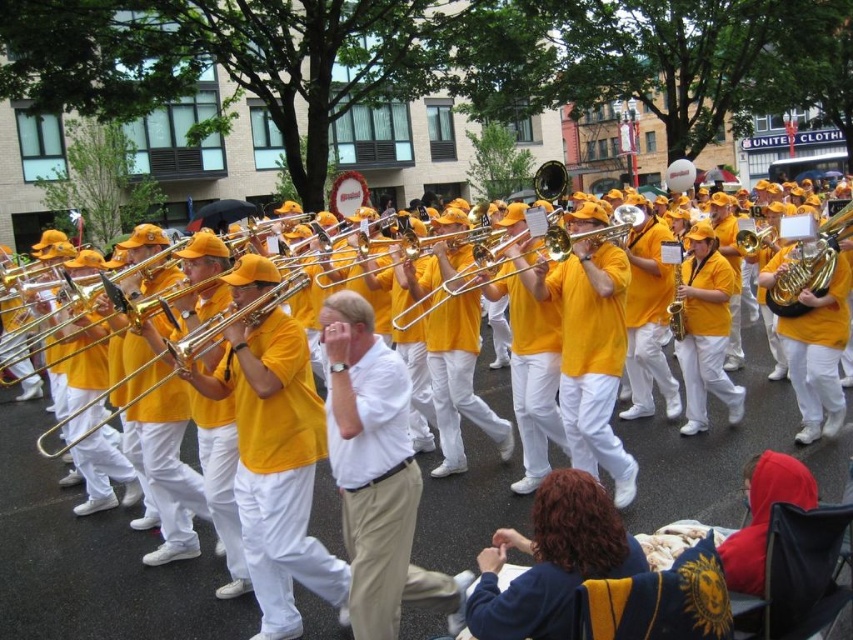
You are a photographer positioned at the center of the street. You want to take a photo that includes both the point at coordinates point (115, 572) and point (384, 616). Based on their positions, which point should be placed closer to the front of the photo to ensure both are visible without overlapping?

Point (384, 616) should be placed closer to the front of the photo because point (115, 572) is behind it, so positioning the latter further back will prevent overlap while keeping both in view.

You are a photographer trying to capture the marching band members holding their instruments. You notice the matte yellow trombone at center and the gold shiny trumpet at center. Which instrument should you focus on if you want to capture an instrument that is wider?

The matte yellow trombone at center might be wider than the gold shiny trumpet at center, so focusing on the matte yellow trombone at center would be better to capture a wider instrument.

You are a photographer standing at the parade. You want to take a closeup photo of the white cotton shirt at center. Considering your current distance, do you think you need to zoom in or out your camera lens?

The white cotton shirt at center is 4.56 meters away from the camera. To take a closeup photo, you would need to zoom in your camera lens to focus on the subject from that distance.